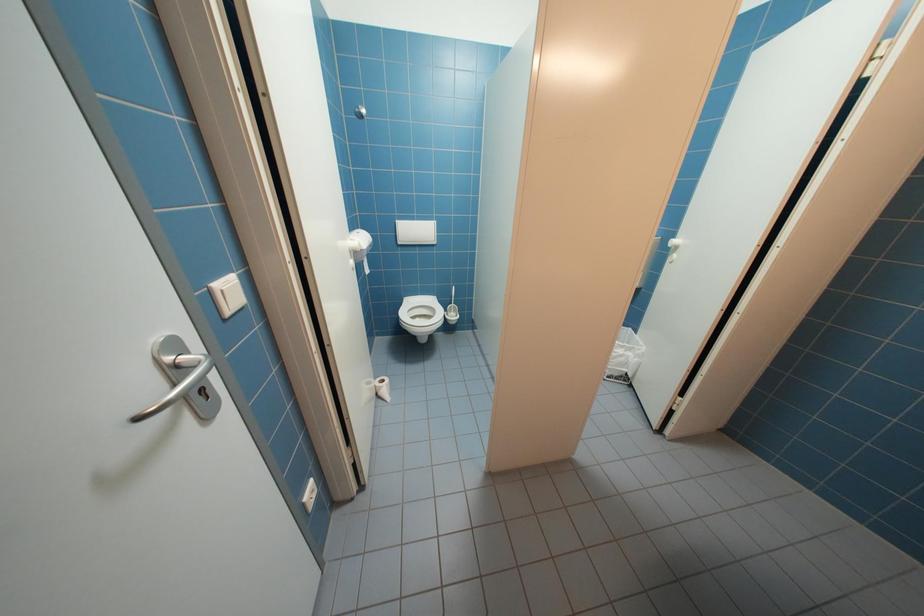
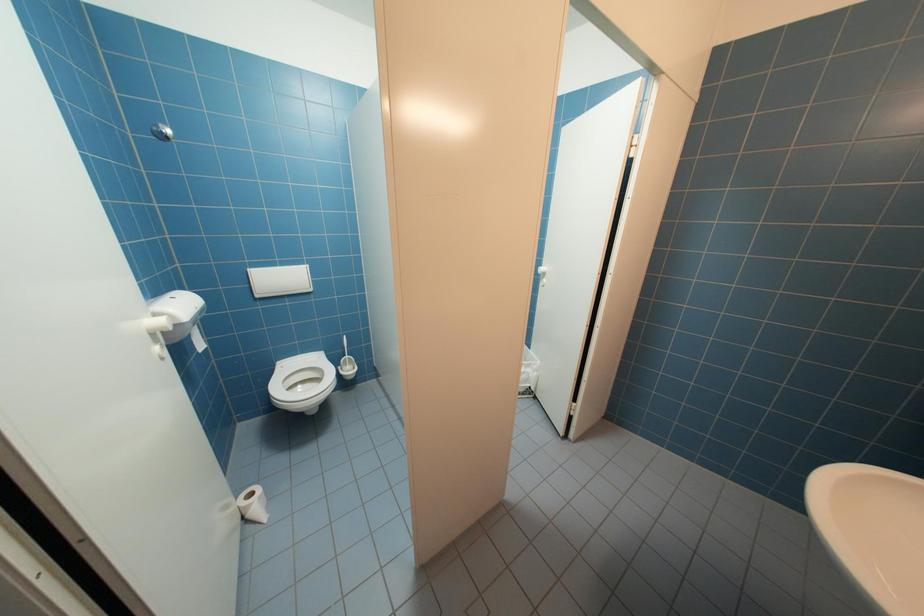
Question: The camera is either moving clockwise (left) or counter-clockwise (right) around the object. The first image is from the beginning of the video and the second image is from the end. Is the camera moving left or right when shooting the video?

Choices:
 (A) Left
 (B) Right

Answer: (A)